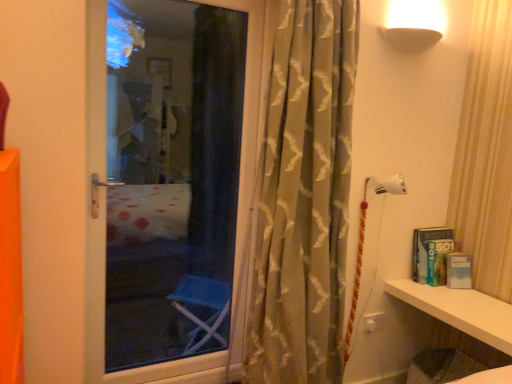
Question: From a real-world perspective, is white glossy shelf at lower right on top of silky beige curtain at center?

Choices:
 (A) no
 (B) yes

Answer: (A)

Question: Is white glossy shelf at lower right wider than silky beige curtain at center?

Choices:
 (A) no
 (B) yes

Answer: (B)

Question: Is white glossy shelf at lower right positioned behind silky beige curtain at center?

Choices:
 (A) no
 (B) yes

Answer: (B)

Question: From the image's perspective, is white glossy shelf at lower right below silky beige curtain at center?

Choices:
 (A) yes
 (B) no

Answer: (A)

Question: Does white glossy shelf at lower right lie in front of silky beige curtain at center?

Choices:
 (A) yes
 (B) no

Answer: (B)

Question: Is white glossy shelf at lower right looking in the opposite direction of silky beige curtain at center?

Choices:
 (A) no
 (B) yes

Answer: (A)

Question: Is silky beige curtain at center not close to white glossy shelf at lower right?

Choices:
 (A) yes
 (B) no

Answer: (B)

Question: From the image's perspective, is silky beige curtain at center on white glossy shelf at lower right?

Choices:
 (A) yes
 (B) no

Answer: (A)

Question: Is silky beige curtain at center smaller than white glossy shelf at lower right?

Choices:
 (A) no
 (B) yes

Answer: (A)

Question: Is silky beige curtain at center taller than white glossy shelf at lower right?

Choices:
 (A) yes
 (B) no

Answer: (A)

Question: Does silky beige curtain at center appear on the right side of white glossy shelf at lower right?

Choices:
 (A) yes
 (B) no

Answer: (B)

Question: Is silky beige curtain at center thinner than white glossy shelf at lower right?

Choices:
 (A) yes
 (B) no

Answer: (A)

Question: Considering the relative positions of silky beige curtain at center and white glossy shelf at lower right in the image provided, is silky beige curtain at center to the left or to the right of white glossy shelf at lower right?

Choices:
 (A) right
 (B) left

Answer: (B)